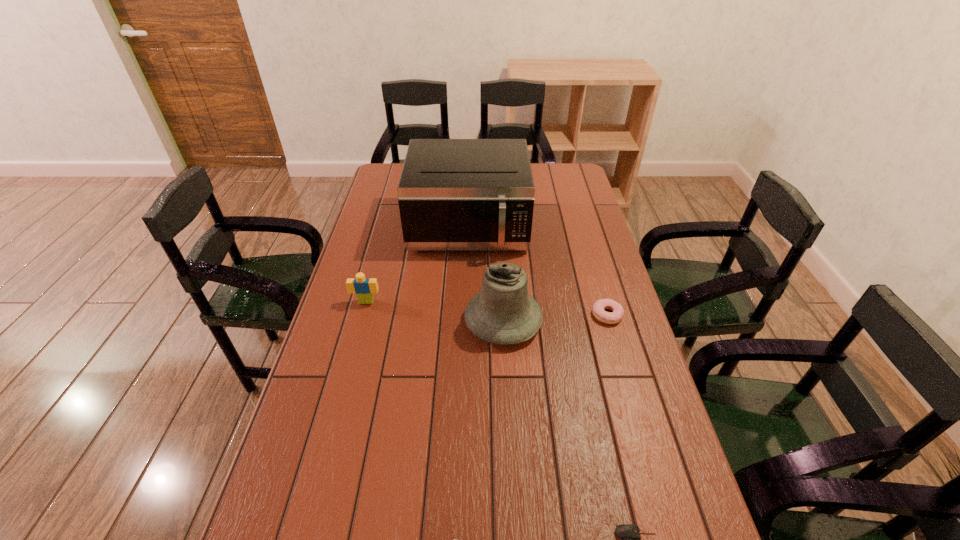
Locate an element on the screen. The width and height of the screenshot is (960, 540). the farthest object is located at coordinates (454, 194).

At what (x,y) coordinates should I click in order to perform the action: click on the tallest object. Please return your answer as a coordinate pair (x, y). Looking at the image, I should click on 454,194.

This screenshot has width=960, height=540. Identify the location of the second tallest object. [503, 313].

Where is `the leftmost object`? The width and height of the screenshot is (960, 540). the leftmost object is located at coordinates pos(364,288).

At what (x,y) coordinates should I click in order to perform the action: click on the fourth shortest object. Please return your answer as a coordinate pair (x, y). Looking at the image, I should click on tap(364, 288).

At what (x,y) coordinates should I click in order to perform the action: click on the second shortest object. Please return your answer as a coordinate pair (x, y). Looking at the image, I should click on (600, 314).

You are a GUI agent. You are given a task and a screenshot of the screen. Output one action in this format:
    pyautogui.click(x=<x>, y=<y>)
    Task: Click on the vacant space located on the front-facing side of the tallest object
    The height and width of the screenshot is (540, 960).
    Given the screenshot: What is the action you would take?
    pyautogui.click(x=466, y=302)

Locate an element on the screen. The height and width of the screenshot is (540, 960). vacant space situated 0.050m on the right of the second tallest object is located at coordinates (558, 321).

This screenshot has width=960, height=540. Identify the location of blank space located 0.210m on the face of the Lego. (351, 357).

You are a GUI agent. You are given a task and a screenshot of the screen. Output one action in this format:
    pyautogui.click(x=<x>, y=<y>)
    Task: Click on the free region located 0.360m on the left of the doughnut
    This screenshot has width=960, height=540.
    Given the screenshot: What is the action you would take?
    pyautogui.click(x=476, y=315)